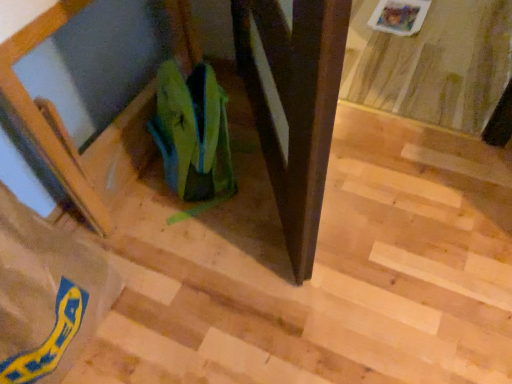
Question: Is brown paper bag at lower left, which appears as the 2th grocery bag when viewed from the right, outside green fabric bag at center, arranged as the first grocery bag when viewed from the right?

Choices:
 (A) no
 (B) yes

Answer: (B)

Question: From the image's perspective, is brown paper bag at lower left, which appears as the 2th grocery bag when viewed from the right, located above green fabric bag at center, the 2th grocery bag viewed from the left?

Choices:
 (A) yes
 (B) no

Answer: (B)

Question: Does brown paper bag at lower left, marked as the first grocery bag in a left-to-right arrangement, have a greater width compared to green fabric bag at center, arranged as the first grocery bag when viewed from the right?

Choices:
 (A) no
 (B) yes

Answer: (B)

Question: Can you confirm if brown paper bag at lower left, marked as the first grocery bag in a left-to-right arrangement, is shorter than green fabric bag at center, the 2th grocery bag viewed from the left?

Choices:
 (A) yes
 (B) no

Answer: (B)

Question: Could you tell me if brown paper bag at lower left, which appears as the 2th grocery bag when viewed from the right, is turned towards green fabric bag at center, the 2th grocery bag viewed from the left?

Choices:
 (A) yes
 (B) no

Answer: (B)

Question: Is brown paper bag at lower left, marked as the first grocery bag in a left-to-right arrangement, with green fabric bag at center, arranged as the first grocery bag when viewed from the right?

Choices:
 (A) yes
 (B) no

Answer: (B)

Question: Does green fabric bag at center, arranged as the first grocery bag when viewed from the right, come behind brown paper bag at lower left, which appears as the 2th grocery bag when viewed from the right?

Choices:
 (A) yes
 (B) no

Answer: (A)

Question: Does green fabric bag at center, arranged as the first grocery bag when viewed from the right, come in front of brown paper bag at lower left, which appears as the 2th grocery bag when viewed from the right?

Choices:
 (A) no
 (B) yes

Answer: (A)

Question: Does green fabric bag at center, the 2th grocery bag viewed from the left, appear on the left side of brown paper bag at lower left, marked as the first grocery bag in a left-to-right arrangement?

Choices:
 (A) no
 (B) yes

Answer: (A)

Question: From a real-world perspective, is green fabric bag at center, the 2th grocery bag viewed from the left, located higher than brown paper bag at lower left, which appears as the 2th grocery bag when viewed from the right?

Choices:
 (A) yes
 (B) no

Answer: (B)

Question: Is green fabric bag at center, arranged as the first grocery bag when viewed from the right, at the right side of brown paper bag at lower left, which appears as the 2th grocery bag when viewed from the right?

Choices:
 (A) yes
 (B) no

Answer: (A)

Question: Can you confirm if green fabric bag at center, the 2th grocery bag viewed from the left, is thinner than brown paper bag at lower left, marked as the first grocery bag in a left-to-right arrangement?

Choices:
 (A) no
 (B) yes

Answer: (B)

Question: Is brown paper bag at lower left, marked as the first grocery bag in a left-to-right arrangement, taller or shorter than green fabric bag at center, the 2th grocery bag viewed from the left?

Choices:
 (A) tall
 (B) short

Answer: (A)